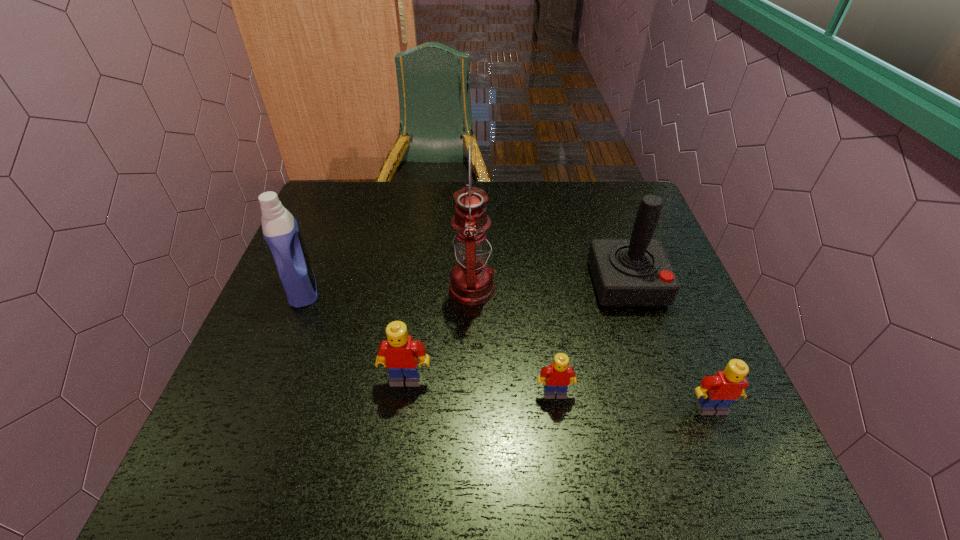
Find the location of a particular element. Image resolution: width=960 pixels, height=540 pixels. free space at the left edge is located at coordinates (335, 273).

Identify the location of free space at the far right corner. (625, 219).

Identify the location of vacant space that's between the joystick and the third object from right to left. This screenshot has height=540, width=960. (590, 338).

Locate an element on the screen. vacant space in between the joystick and the second Lego from right to left is located at coordinates (590, 338).

Locate an element on the screen. This screenshot has width=960, height=540. unoccupied position between the leftmost Lego and the joystick is located at coordinates (516, 331).

Locate an element on the screen. This screenshot has width=960, height=540. unoccupied area between the tallest object and the second shortest Lego is located at coordinates [x=591, y=348].

Where is `vacant space that is in between the tallest object and the second object from left to right`? The width and height of the screenshot is (960, 540). vacant space that is in between the tallest object and the second object from left to right is located at coordinates (439, 334).

At what (x,y) coordinates should I click in order to perform the action: click on vacant area that lies between the leftmost Lego and the third object from left to right. Please return your answer as a coordinate pair (x, y). This screenshot has width=960, height=540. Looking at the image, I should click on (439, 334).

Identify the location of free space between the third object from left to right and the leftmost object. The height and width of the screenshot is (540, 960). pyautogui.click(x=388, y=289).

At what (x,y) coordinates should I click in order to perform the action: click on free space between the detergent and the fifth object from right to left. Please return your answer as a coordinate pair (x, y). Looking at the image, I should click on (354, 334).